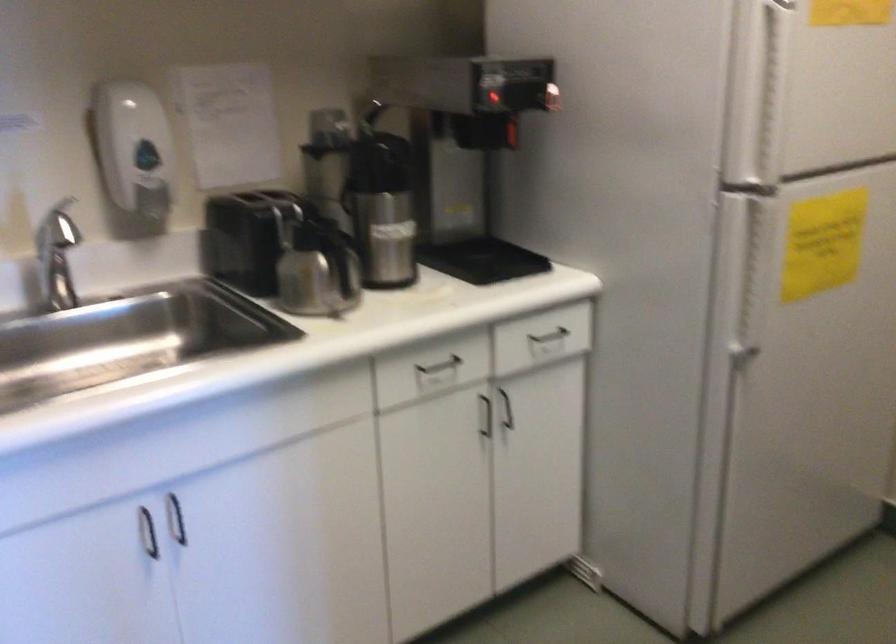
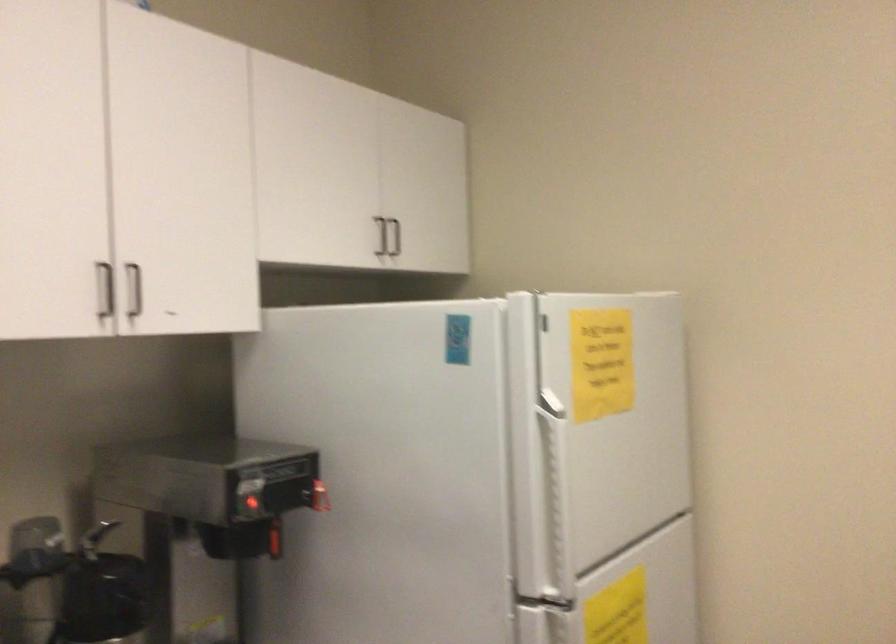
Locate, in the second image, the point that corresponds to pixel 769 78 in the first image.

(554, 486)